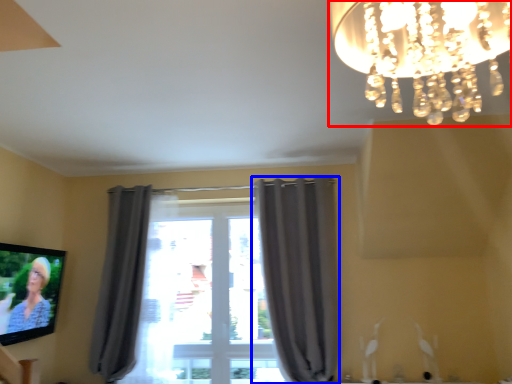
Question: Which point is further to the camera, lamp (highlighted by a red box) or curtain (highlighted by a blue box)?

Choices:
 (A) lamp
 (B) curtain

Answer: (B)